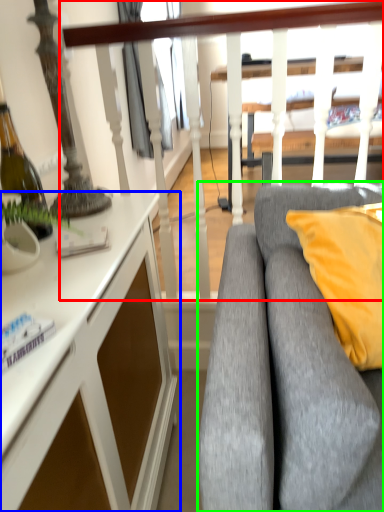
Question: Based on their relative distances, which object is farther from rail (highlighted by a red box)? Choose from desk (highlighted by a blue box) and studio couch (highlighted by a green box).

Choices:
 (A) desk
 (B) studio couch

Answer: (A)